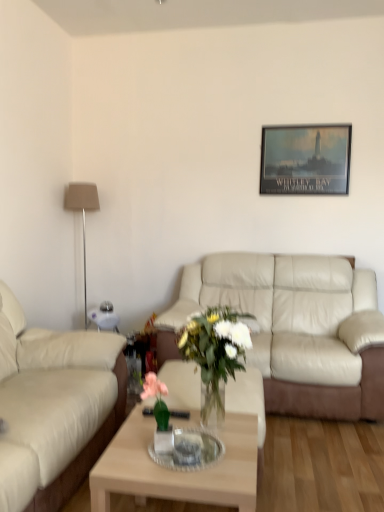
Find the location of a particular element. This screenshot has height=512, width=384. vacant area on top of clear glass tray at center (from a real-world perspective) is located at coordinates (201, 446).